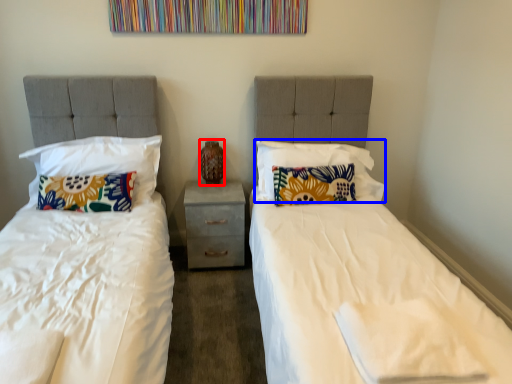
Question: Among these objects, which one is nearest to the camera, vase (highlighted by a red box) or pillow (highlighted by a blue box)?

Choices:
 (A) vase
 (B) pillow

Answer: (B)